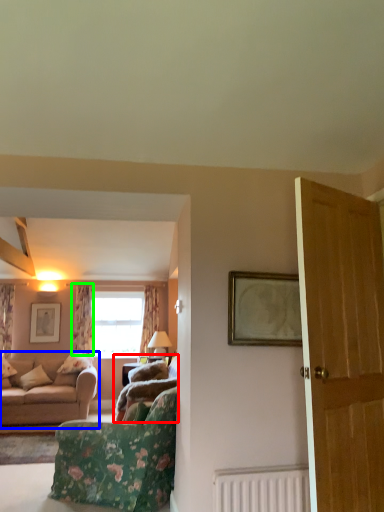
Question: Which object is positioned closest to studio couch (highlighted by a red box)? Select from studio couch (highlighted by a blue box) and curtain (highlighted by a green box).

Choices:
 (A) studio couch
 (B) curtain

Answer: (A)